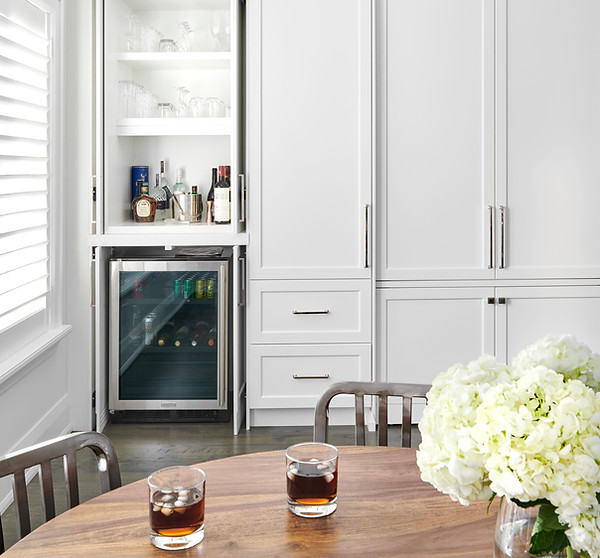
This screenshot has width=600, height=558. Find the location of `drawer pull`. drawer pull is located at coordinates (301, 309), (303, 376).